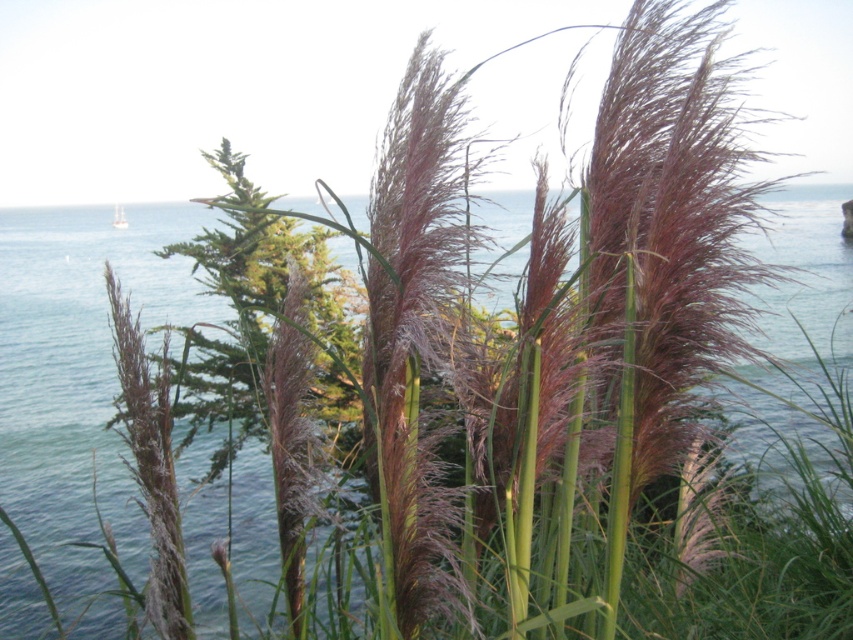
Question: Which point is farther to the camera?

Choices:
 (A) (143, 224)
 (B) (123, 216)

Answer: (A)

Question: Which object is farther from the camera taking this photo?

Choices:
 (A) blue water at center
 (B) white wooden boat at center

Answer: (B)

Question: Does blue water at center lie in front of white wooden boat at center?

Choices:
 (A) yes
 (B) no

Answer: (A)

Question: Can you confirm if blue water at center is positioned to the right of white wooden boat at center?

Choices:
 (A) yes
 (B) no

Answer: (A)

Question: Observing the image, what is the correct spatial positioning of blue water at center in reference to white wooden boat at center?

Choices:
 (A) below
 (B) above

Answer: (A)